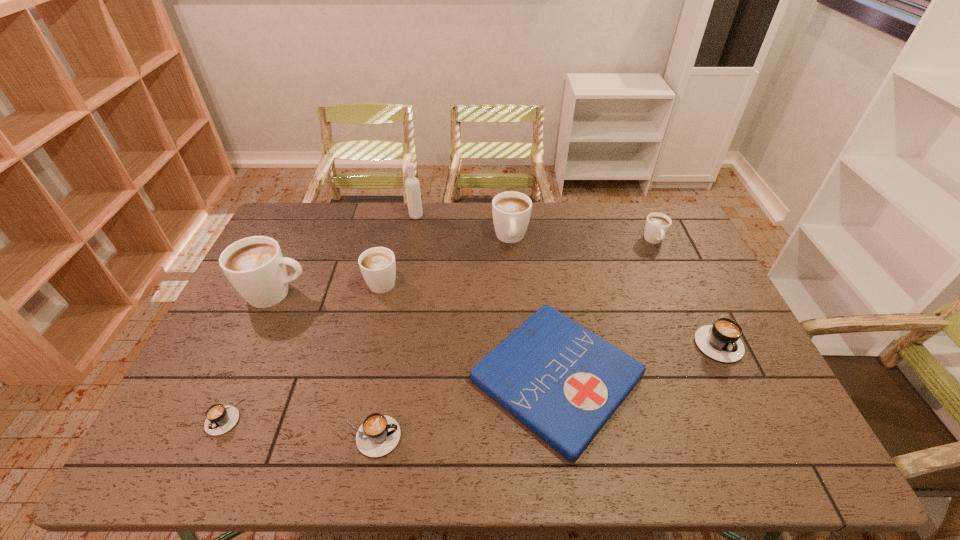
Identify the location of white vodka. (412, 185).

Where is `the farthest object`? The width and height of the screenshot is (960, 540). the farthest object is located at coordinates (412, 185).

Find the location of a particular element. This screenshot has width=960, height=540. the leftmost white cappuccino is located at coordinates (255, 266).

The height and width of the screenshot is (540, 960). Find the location of `the second tallest object`. the second tallest object is located at coordinates (255, 266).

Where is `the fifth cappuccino from left to right`? The image size is (960, 540). the fifth cappuccino from left to right is located at coordinates (511, 210).

Locate an element on the screen. This screenshot has height=540, width=960. the second white cappuccino from right to left is located at coordinates (511, 210).

Image resolution: width=960 pixels, height=540 pixels. I want to click on the third tallest cappuccino, so click(x=378, y=266).

Where is `the sixth shortest object`? the sixth shortest object is located at coordinates (378, 266).

Where is `the smallest white cappuccino`? Image resolution: width=960 pixels, height=540 pixels. the smallest white cappuccino is located at coordinates (657, 225).

This screenshot has width=960, height=540. Identify the location of the biggest black cappuccino. (721, 341).